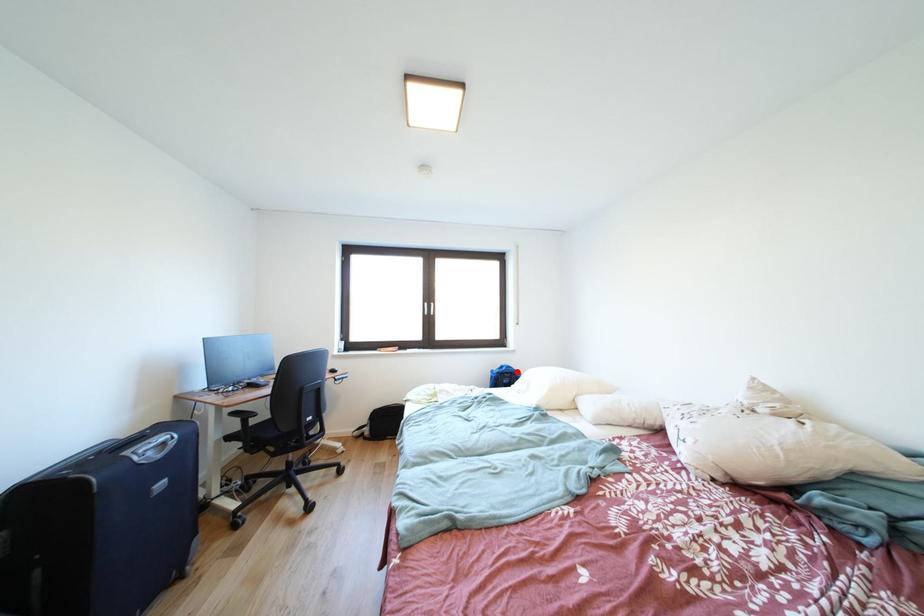
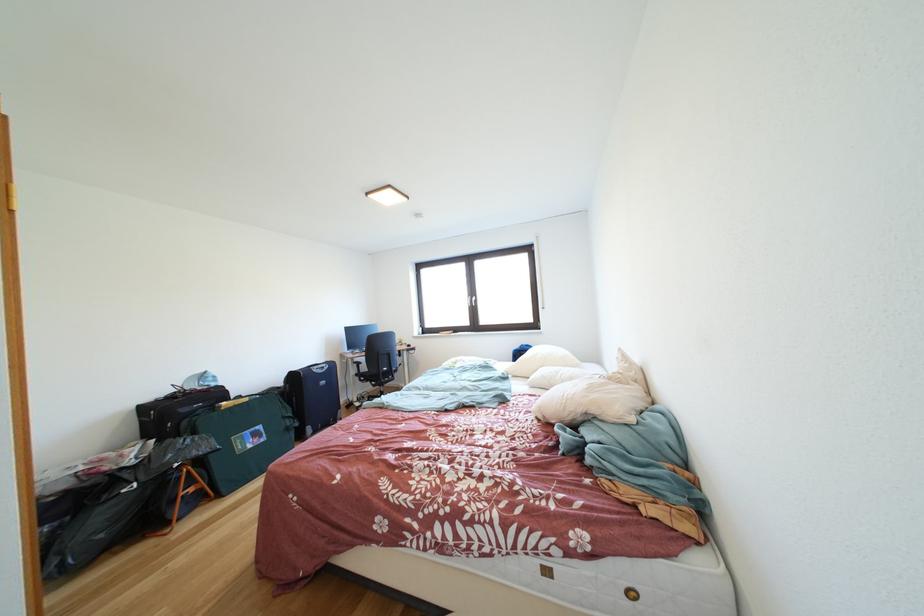
Question: I am providing you with two images of the same scene from different viewpoints. Image1 has a red point marked. In image2, the corresponding 3D location appears at what relative position? Reply with the corresponding letter.

Choices:
 (A) Closer
 (B) Farther

Answer: (A)